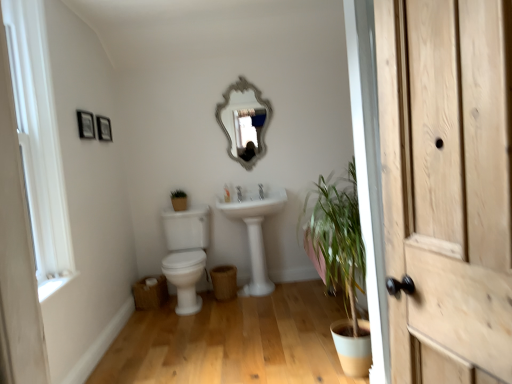
Where is `vacant space in front of white glossy toilet at center-left`? vacant space in front of white glossy toilet at center-left is located at coordinates (179, 333).